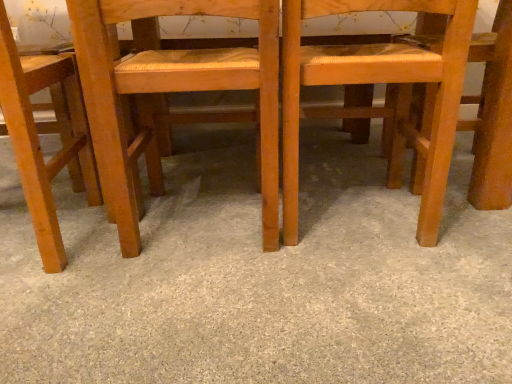
Question: Relative to matte wood chair at left, which is the third chair in right-to-left order, is wooden chair at center, the 2th chair when ordered from right to left, in front or behind?

Choices:
 (A) behind
 (B) front

Answer: (A)

Question: Is point (252, 54) closer or farther from the camera than point (28, 59)?

Choices:
 (A) farther
 (B) closer

Answer: (A)

Question: Estimate the real-world distances between objects in this image. Which object is closer to the gray carpet at center?

Choices:
 (A) wooden chair at center, the 1th chair in the right-to-left sequence
 (B) wooden chair at center, the 2th chair in the left-to-right sequence
 (C) matte wood chair at left, the first chair in the left-to-right sequence

Answer: (B)

Question: Based on their relative distances, which object is farther from the gray carpet at center?

Choices:
 (A) matte wood chair at left, which is the third chair in right-to-left order
 (B) wooden chair at center, the 2th chair when ordered from right to left
 (C) wooden chair at center, which is counted as the third chair, starting from the left

Answer: (A)